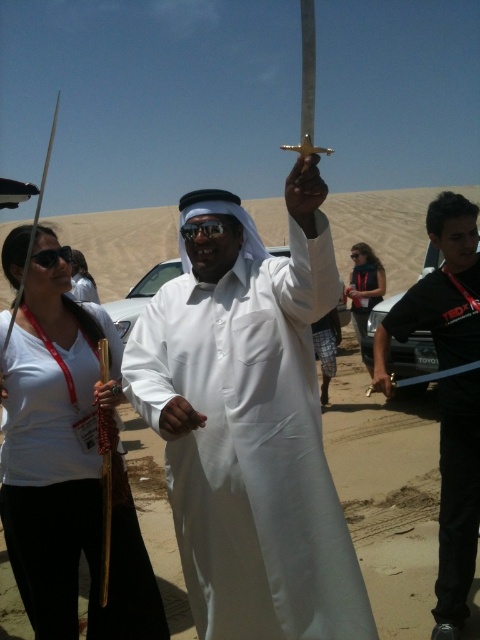
Question: Which point is closer to the camera taking this photo?

Choices:
 (A) (214, 294)
 (B) (76, 259)
 (C) (51, 572)
 (D) (382, 285)

Answer: (C)

Question: Observing the image, what is the correct spatial positioning of matte black sunglasses at upper left in reference to denim jacket at center?

Choices:
 (A) right
 (B) left

Answer: (B)

Question: Among these objects, which one is nearest to the camera?

Choices:
 (A) white matte sword at center
 (B) matte black sword at center
 (C) denim jacket at center

Answer: (A)

Question: Is white matte sword at center behind matte white shirt at center?

Choices:
 (A) no
 (B) yes

Answer: (A)

Question: Can you confirm if matte black sword at center is positioned to the left of denim jacket at center?

Choices:
 (A) no
 (B) yes

Answer: (B)

Question: Considering the real-world distances, which object is farthest from the denim jacket at center?

Choices:
 (A) matte white shirt at center
 (B) matte black sunglasses at upper left
 (C) white matte sword at center
 (D) matte black sword at center

Answer: (B)